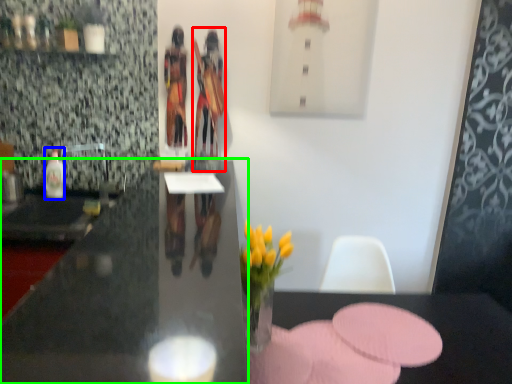
Question: Which is nearer to the person (highlighted by a red box)? bottle (highlighted by a blue box) or desk (highlighted by a green box).

Choices:
 (A) bottle
 (B) desk

Answer: (A)